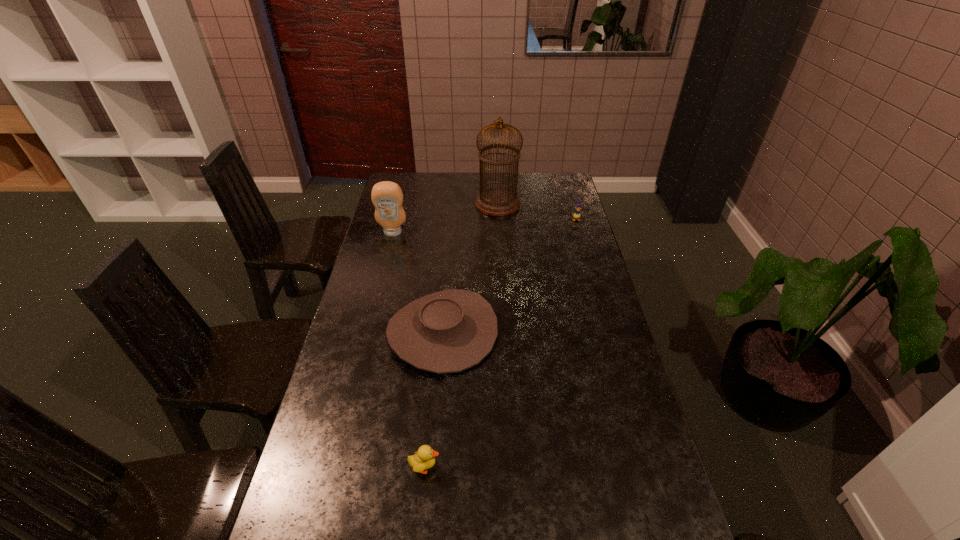
Identify the location of vacant space at the far edge. 529,192.

The height and width of the screenshot is (540, 960). In order to click on vacant space at the left edge in this screenshot , I will do `click(369, 451)`.

The height and width of the screenshot is (540, 960). I want to click on vacant space at the right edge of the desktop, so click(x=558, y=246).

Image resolution: width=960 pixels, height=540 pixels. I want to click on free space between the birdcage and the fourth shortest object, so click(x=445, y=218).

At what (x,y) coordinates should I click in order to perform the action: click on unoccupied position between the third nearest object and the farthest object. Please return your answer as a coordinate pair (x, y). The width and height of the screenshot is (960, 540). Looking at the image, I should click on (445, 218).

Locate an element on the screen. The width and height of the screenshot is (960, 540). unoccupied area between the tallest object and the rightmost object is located at coordinates (537, 212).

What are the coordinates of `blank region between the fourth farthest object and the third nearest object` in the screenshot? It's located at (418, 282).

At what (x,y) coordinates should I click in order to perform the action: click on object that is the second closest to the farther duckling. Please return your answer as a coordinate pair (x, y). This screenshot has width=960, height=540. Looking at the image, I should click on (449, 331).

Identify which object is the third closest to the cowboy hat. Please provide its 2D coordinates. Your answer should be formatted as a tuple, i.e. [(x, y)], where the tuple contains the x and y coordinates of a point satisfying the conditions above.

[(497, 201)]

Image resolution: width=960 pixels, height=540 pixels. In order to click on duckling that is the second closest to the condiment in this screenshot , I will do `click(424, 459)`.